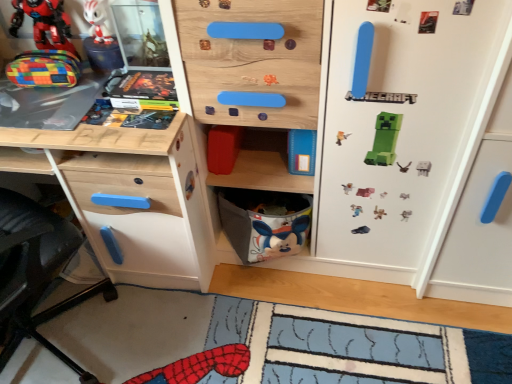
Where is `vacant area in front of multicolored fabric pouch at left, positioned as the 1th toy in bottom-to-top order`? vacant area in front of multicolored fabric pouch at left, positioned as the 1th toy in bottom-to-top order is located at coordinates (42, 109).